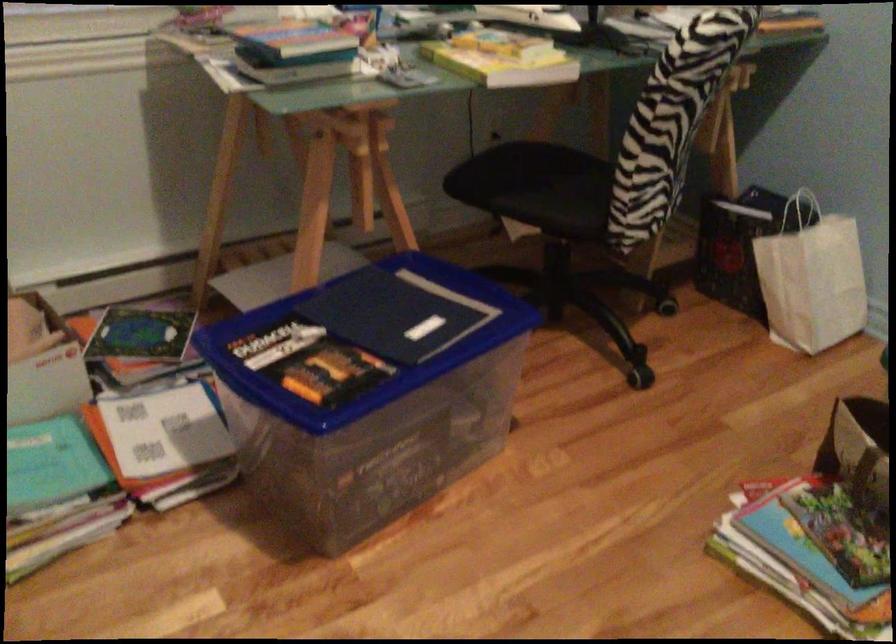
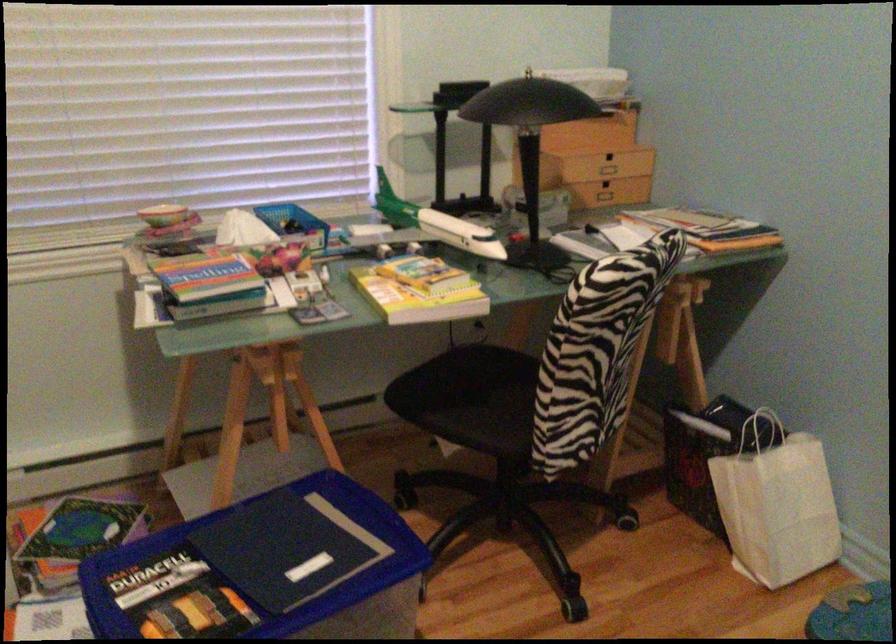
Find the pixel in the second image that matches the point at 381,335 in the first image.

(264, 570)